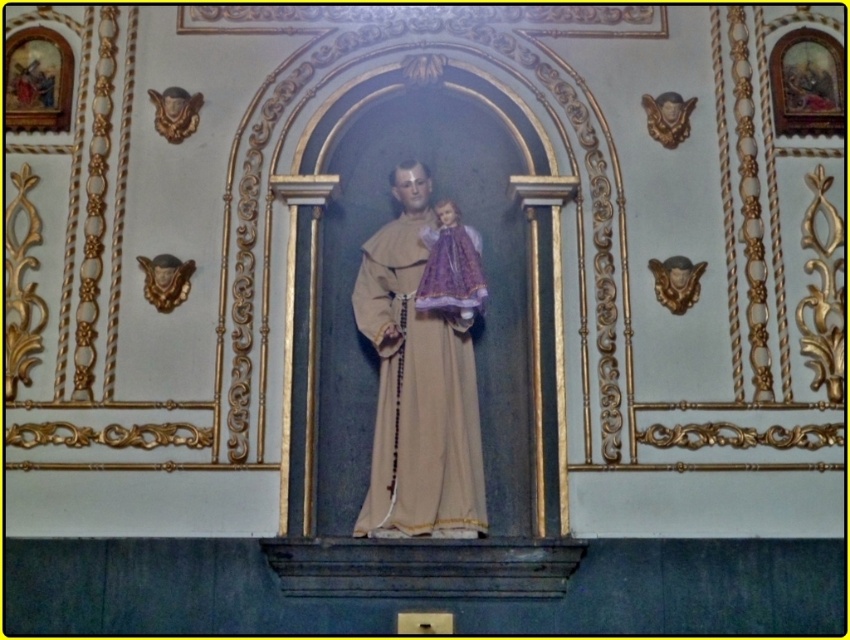
You are an art conservator assessing the placement of objects in the alcove. You need to ensure that the purple satin doll at center is positioned lower than the matte gold statue at center to maintain the intended visual hierarchy. Based on the description, is the current arrangement correct?

The matte gold statue at center is taller than the purple satin doll at center, so the current arrangement already positions the purple satin doll at center lower than the matte gold statue at center, maintaining the intended visual hierarchy.

You are standing in front of the religious statue and want to place a small bouquet of flowers at the base of the statue. The bouquet requires a space of 0.5 units in width. Can the area at point (x=416, y=387) accommodate the bouquet?

The area at point (x=416, y=387) is occupied by the matte gold statue at center, so there is no space to place the bouquet there.